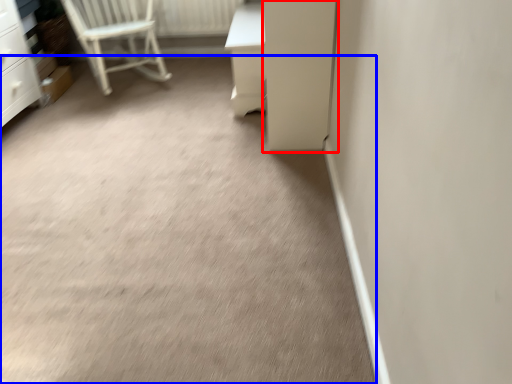
Question: Which object appears farthest to the camera in this image, screen door (highlighted by a red box) or concrete (highlighted by a blue box)?

Choices:
 (A) screen door
 (B) concrete

Answer: (A)